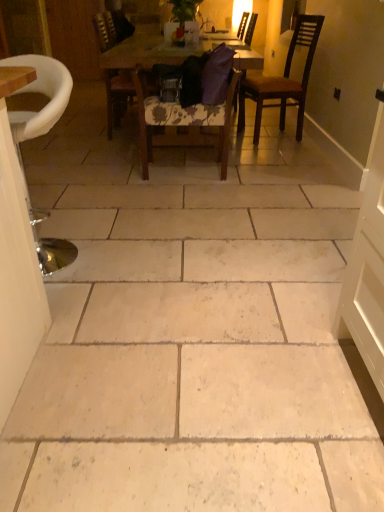
Where is `wooden chair at center, the 2th chair when ordered from back to front`? wooden chair at center, the 2th chair when ordered from back to front is located at coordinates (116, 93).

Measure the distance between metallic silver stool at left, which is the first chair from front to back, and camera.

A distance of 1.29 meters exists between metallic silver stool at left, which is the first chair from front to back, and camera.

At what (x,y) coordinates should I click in order to perform the action: click on metallic silver stool at left, which is the 5th chair from back to front. Please return your answer as a coordinate pair (x, y). The height and width of the screenshot is (512, 384). Looking at the image, I should click on (41, 93).

Identify the location of floral fabric chair at center, the 2th chair viewed from the front. The image size is (384, 512). (183, 123).

You are a GUI agent. You are given a task and a screenshot of the screen. Output one action in this format:
    pyautogui.click(x=<x>, y=<y>)
    Task: Click on the purple fabric chair at center, which appears as the 5th chair when viewed from the front
    The image size is (384, 512).
    Given the screenshot: What is the action you would take?
    pyautogui.click(x=246, y=42)

Describe the element at coordinates (283, 80) in the screenshot. I see `dark brown wooden chair at upper right, the 3th chair viewed from the back` at that location.

At what (x,y) coordinates should I click in order to perform the action: click on wooden chair at center, the 2th chair when ordered from back to front. Please return your answer as a coordinate pair (x, y). This screenshot has width=384, height=512. Looking at the image, I should click on (116, 93).

Consider the image. Which object is wider, wooden table at center or wooden chair at center, the 2th chair when ordered from back to front?

wooden table at center.

Would you consider wooden table at center to be distant from wooden chair at center, the 2th chair when ordered from back to front?

They are positioned close to each other.

Consider the image. From a real-world perspective, is wooden table at center located higher than wooden chair at center, the 4th chair viewed from the front?

Incorrect, from a real-world perspective, wooden table at center is lower than wooden chair at center, the 4th chair viewed from the front.

Which object is further away from the camera, wooden table at center or wooden chair at center, the 4th chair viewed from the front?

wooden chair at center, the 4th chair viewed from the front, is further away from the camera.

Does wooden door at left have a greater width compared to floral fabric chair at center, which is counted as the fourth chair, starting from the back?

No, wooden door at left is not wider than floral fabric chair at center, which is counted as the fourth chair, starting from the back.

Which of these two, wooden door at left or floral fabric chair at center, the 2th chair viewed from the front, is bigger?

With larger size is floral fabric chair at center, the 2th chair viewed from the front.

The width and height of the screenshot is (384, 512). Find the location of `door above the floral fabric chair at center, the 2th chair viewed from the front (from the image's perspective)`. door above the floral fabric chair at center, the 2th chair viewed from the front (from the image's perspective) is located at coordinates (74, 36).

Is floral fabric chair at center, the 2th chair viewed from the front, inside or outside of wooden table at center?

The correct answer is: outside.

Is floral fabric chair at center, which is counted as the fourth chair, starting from the back, wider than wooden table at center?

No, floral fabric chair at center, which is counted as the fourth chair, starting from the back, is not wider than wooden table at center.

Is floral fabric chair at center, which is counted as the fourth chair, starting from the back, positioned before wooden table at center?

That is True.

Does floral fabric chair at center, the 2th chair viewed from the front, appear on the right side of wooden table at center?

Indeed, floral fabric chair at center, the 2th chair viewed from the front, is positioned on the right side of wooden table at center.

From a real-world perspective, which object rests below the other?

floral fabric chair at center, the 2th chair viewed from the front.

Between metallic silver stool at left, which is the 5th chair from back to front, and floral fabric chair at center, which is counted as the fourth chair, starting from the back, which one appears on the left side from the viewer's perspective?

Positioned to the left is metallic silver stool at left, which is the 5th chair from back to front.

Does metallic silver stool at left, which is the first chair from front to back, lie behind floral fabric chair at center, which is counted as the fourth chair, starting from the back?

No, metallic silver stool at left, which is the first chair from front to back, is closer to the camera.

Are metallic silver stool at left, which is the first chair from front to back, and floral fabric chair at center, the 2th chair viewed from the front, located far from each other?

Yes, metallic silver stool at left, which is the first chair from front to back, and floral fabric chair at center, the 2th chair viewed from the front, are quite far apart.

In the scene shown: Does purple fabric chair at center, which appears as the 5th chair when viewed from the front, touch dark brown wooden chair at upper right, the third chair when ordered from front to back?

No, purple fabric chair at center, which appears as the 5th chair when viewed from the front, is not beside dark brown wooden chair at upper right, the third chair when ordered from front to back.

Could you measure the distance between purple fabric chair at center, which appears as the 5th chair when viewed from the front, and dark brown wooden chair at upper right, the third chair when ordered from front to back?

They are 24.63 inches apart.

Which point is more distant from viewer, (244, 59) or (281, 126)?

The point (281, 126) is farther.

Which of these two, purple fabric chair at center, which appears as the 5th chair when viewed from the front, or dark brown wooden chair at upper right, the 3th chair viewed from the back, stands taller?

With more height is purple fabric chair at center, which appears as the 5th chair when viewed from the front.

How different are the orientations of wooden chair at center, the 4th chair viewed from the front, and wooden door at left in degrees?

The angular difference between wooden chair at center, the 4th chair viewed from the front, and wooden door at left is 90.1 degrees.

Looking at this image, measure the distance between wooden chair at center, the 2th chair when ordered from back to front, and wooden door at left.

1.82 meters.

Does wooden chair at center, the 2th chair when ordered from back to front, appear on the right side of wooden door at left?

Yes, wooden chair at center, the 2th chair when ordered from back to front, is to the right of wooden door at left.

Are wooden chair at center, the 4th chair viewed from the front, and wooden door at left far apart?

Yes, wooden chair at center, the 4th chair viewed from the front, is far from wooden door at left.

Between purple fabric chair at center, placed as the first chair when sorted from back to front, and wooden door at left, which one is positioned behind?

wooden door at left.

Is purple fabric chair at center, placed as the first chair when sorted from back to front, oriented away from wooden door at left?

No, purple fabric chair at center, placed as the first chair when sorted from back to front, is not facing the opposite direction of wooden door at left.

Would you say wooden door at left is part of purple fabric chair at center, which appears as the 5th chair when viewed from the front,'s contents?

No, wooden door at left is located outside of purple fabric chair at center, which appears as the 5th chair when viewed from the front.

Is purple fabric chair at center, placed as the first chair when sorted from back to front, far from wooden door at left?

Yes.

Starting from the wooden table at center, which chair is the 1st one to the left? Please provide its 2D coordinates.

[(116, 93)]

In order to click on door above the floral fabric chair at center, the 2th chair viewed from the front (from the image's perspective) in this screenshot , I will do `click(74, 36)`.

In the scene shown: Considering their positions, is wooden table at center positioned further to wooden chair at center, the 4th chair viewed from the front, than floral fabric chair at center, which is counted as the fourth chair, starting from the back?

floral fabric chair at center, which is counted as the fourth chair, starting from the back, lies further to wooden chair at center, the 4th chair viewed from the front, than the other object.

Considering their positions, is floral fabric chair at center, the 2th chair viewed from the front, positioned closer to wooden table at center than metallic silver stool at left, which is the first chair from front to back?

Based on the image, floral fabric chair at center, the 2th chair viewed from the front, appears to be nearer to wooden table at center.

From the image, which object appears to be nearer to wooden door at left, purple fabric chair at center, which appears as the 5th chair when viewed from the front, or wooden table at center?

wooden table at center.

When comparing their distances from floral fabric chair at center, the 2th chair viewed from the front, does metallic silver stool at left, which is the first chair from front to back, or purple fabric chair at center, which appears as the 5th chair when viewed from the front, seem closer?

metallic silver stool at left, which is the first chair from front to back, lies closer to floral fabric chair at center, the 2th chair viewed from the front, than the other object.

Looking at the image, which one is located closer to wooden chair at center, the 4th chair viewed from the front, purple fabric chair at center, placed as the first chair when sorted from back to front, or dark brown wooden chair at upper right, the third chair when ordered from front to back?

purple fabric chair at center, placed as the first chair when sorted from back to front, lies closer to wooden chair at center, the 4th chair viewed from the front, than the other object.

Looking at this image, which object lies nearer to the anchor point purple fabric chair at center, which appears as the 5th chair when viewed from the front, dark brown wooden chair at upper right, the 3th chair viewed from the back, or wooden door at left?

dark brown wooden chair at upper right, the 3th chair viewed from the back.

Considering their positions, is wooden chair at center, the 4th chair viewed from the front, positioned further to floral fabric chair at center, the 2th chair viewed from the front, than wooden door at left?

wooden door at left is positioned further to the anchor floral fabric chair at center, the 2th chair viewed from the front.

Considering their positions, is metallic silver stool at left, which is the first chair from front to back, positioned closer to dark brown wooden chair at upper right, the 3th chair viewed from the back, than wooden table at center?

wooden table at center is positioned closer to the anchor dark brown wooden chair at upper right, the 3th chair viewed from the back.

This screenshot has width=384, height=512. Find the location of `kitchen & dining room table between metallic silver stool at left, which is the 5th chair from back to front, and purple fabric chair at center, which appears as the 5th chair when viewed from the front, from front to back`. kitchen & dining room table between metallic silver stool at left, which is the 5th chair from back to front, and purple fabric chair at center, which appears as the 5th chair when viewed from the front, from front to back is located at coordinates (142, 58).

This screenshot has width=384, height=512. Find the location of `kitchen & dining room table located between floral fabric chair at center, the 2th chair viewed from the front, and purple fabric chair at center, which appears as the 5th chair when viewed from the front, in the depth direction`. kitchen & dining room table located between floral fabric chair at center, the 2th chair viewed from the front, and purple fabric chair at center, which appears as the 5th chair when viewed from the front, in the depth direction is located at coordinates (142, 58).

You are a GUI agent. You are given a task and a screenshot of the screen. Output one action in this format:
    pyautogui.click(x=<x>, y=<y>)
    Task: Click on the kitchen & dining room table between metallic silver stool at left, which is the 5th chair from back to front, and wooden chair at center, the 2th chair when ordered from back to front, in the front-back direction
    This screenshot has height=512, width=384.
    Given the screenshot: What is the action you would take?
    pyautogui.click(x=142, y=58)

Where is `chair located between wooden chair at center, the 4th chair viewed from the front, and wooden door at left in the depth direction`? Image resolution: width=384 pixels, height=512 pixels. chair located between wooden chair at center, the 4th chair viewed from the front, and wooden door at left in the depth direction is located at coordinates (246, 42).